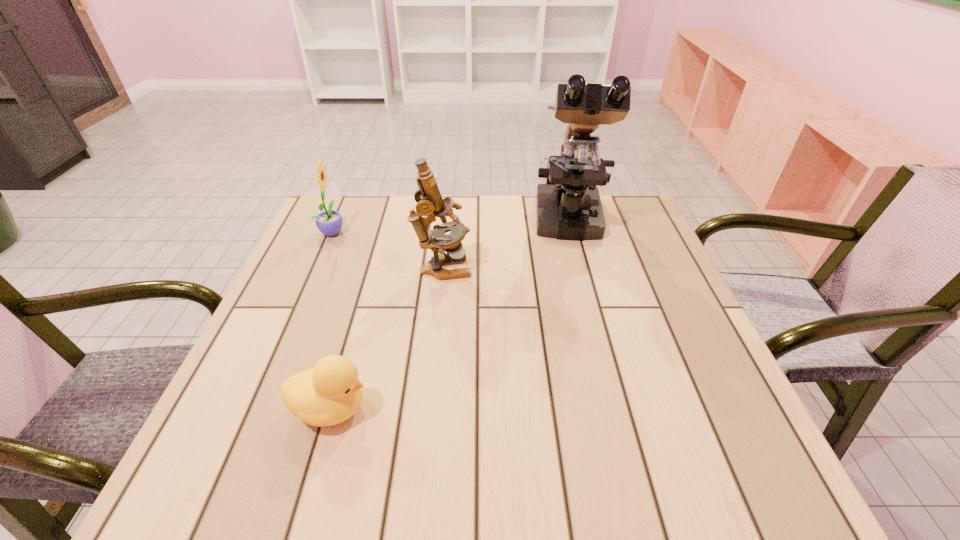
The width and height of the screenshot is (960, 540). I want to click on vacant region that satisfies the following two spatial constraints: 1. on the front-facing side of the left microscope; 2. on the left side of the second shortest object, so click(317, 269).

You are a GUI agent. You are given a task and a screenshot of the screen. Output one action in this format:
    pyautogui.click(x=<x>, y=<y>)
    Task: Click on the vacant space that satisfies the following two spatial constraints: 1. on the front-facing side of the left microscope; 2. on the right side of the second shortest object
    This screenshot has height=540, width=960.
    Given the screenshot: What is the action you would take?
    pyautogui.click(x=317, y=269)